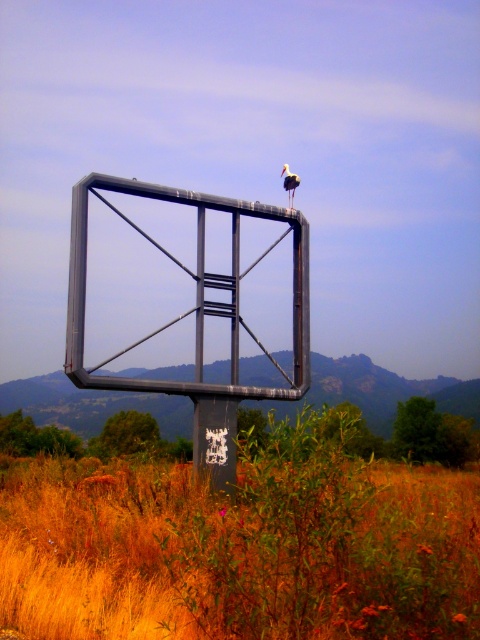
Question: Is brown dry grass at lower center smaller than white matte bird at upper center?

Choices:
 (A) no
 (B) yes

Answer: (A)

Question: Which object is closer to the camera taking this photo?

Choices:
 (A) white matte bird at upper center
 (B) brown dry grass at lower center

Answer: (B)

Question: Does brown dry grass at lower center have a larger size compared to white matte bird at upper center?

Choices:
 (A) yes
 (B) no

Answer: (A)

Question: Among these points, which one is farthest from the camera?

Choices:
 (A) (283, 186)
 (B) (343, 504)

Answer: (A)

Question: Does brown dry grass at lower center appear over white matte bird at upper center?

Choices:
 (A) yes
 (B) no

Answer: (B)

Question: Which object is closer to the camera taking this photo?

Choices:
 (A) white matte bird at upper center
 (B) brown dry grass at lower center

Answer: (B)